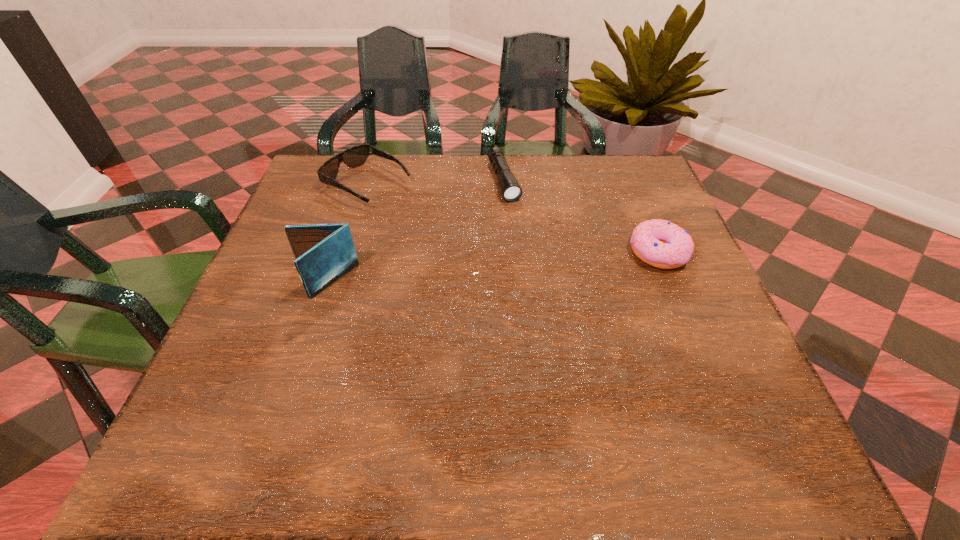
Identify the location of vacant space situated at the lens end of the flashlight. The image size is (960, 540). (535, 266).

Where is `free point located at the lens end of the flashlight`? free point located at the lens end of the flashlight is located at coordinates (559, 323).

Where is `sunglasses that is at the far edge`? The width and height of the screenshot is (960, 540). sunglasses that is at the far edge is located at coordinates (353, 157).

The width and height of the screenshot is (960, 540). I want to click on flashlight at the far edge, so click(x=511, y=191).

What are the coordinates of `wallet that is at the left edge` in the screenshot? It's located at (324, 253).

Find the location of a particular element. sunglasses that is positioned at the left edge is located at coordinates [x=353, y=157].

Where is `object present at the right edge`? Image resolution: width=960 pixels, height=540 pixels. object present at the right edge is located at coordinates (662, 244).

Locate an element on the screen. object that is positioned at the far left corner is located at coordinates [x=353, y=157].

In the image, there is a desktop. Where is `free space at the far edge`? This screenshot has height=540, width=960. free space at the far edge is located at coordinates (547, 205).

Image resolution: width=960 pixels, height=540 pixels. I want to click on free location at the near edge, so click(404, 402).